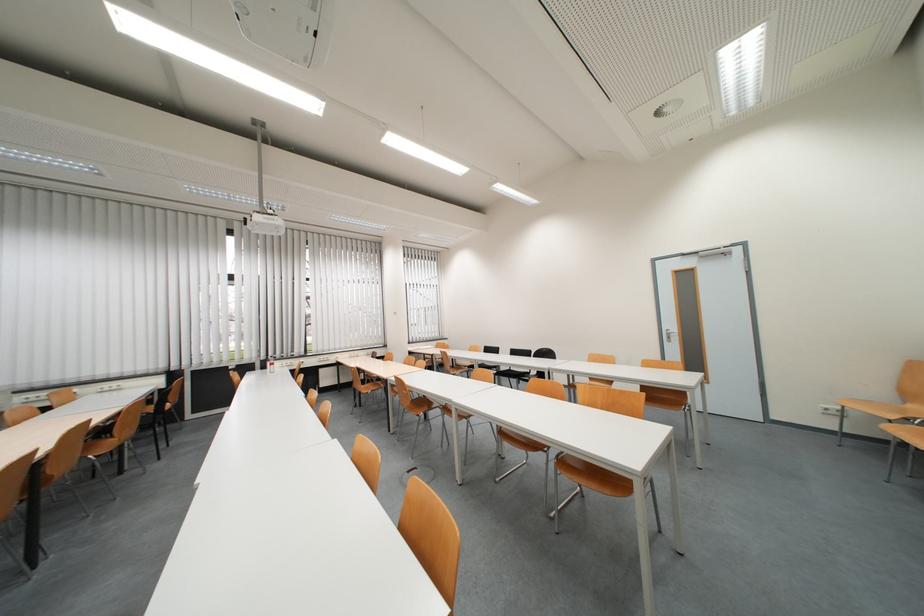
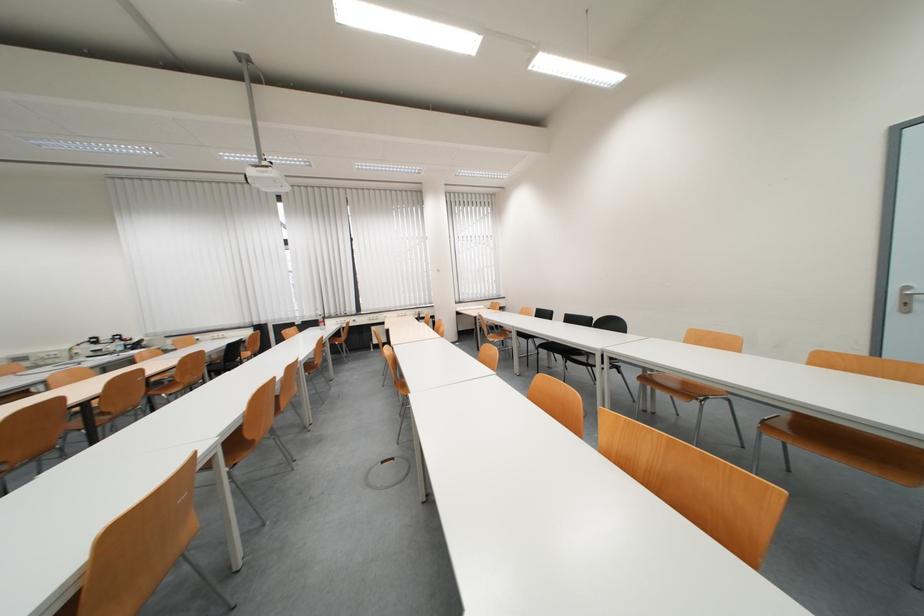
What movement of the cameraman would produce the second image?

The cameraman moved toward right, forward.